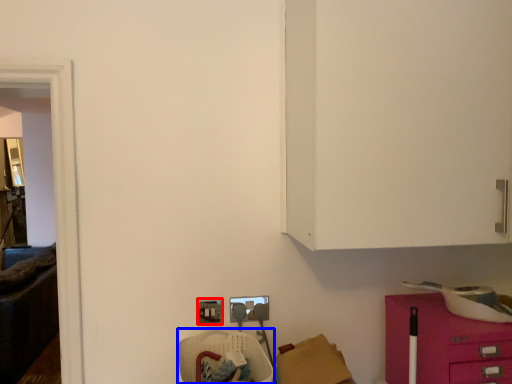
Question: Among these objects, which one is farthest to the camera, electric outlet (highlighted by a red box) or armchair (highlighted by a blue box)?

Choices:
 (A) electric outlet
 (B) armchair

Answer: (A)